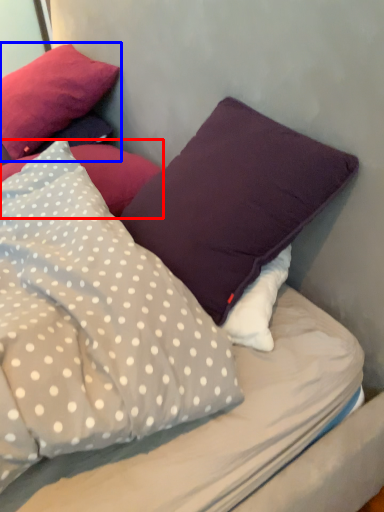
Question: Which of the following is the closest to the observer, pillow (highlighted by a red box) or pillow (highlighted by a blue box)?

Choices:
 (A) pillow
 (B) pillow

Answer: (A)